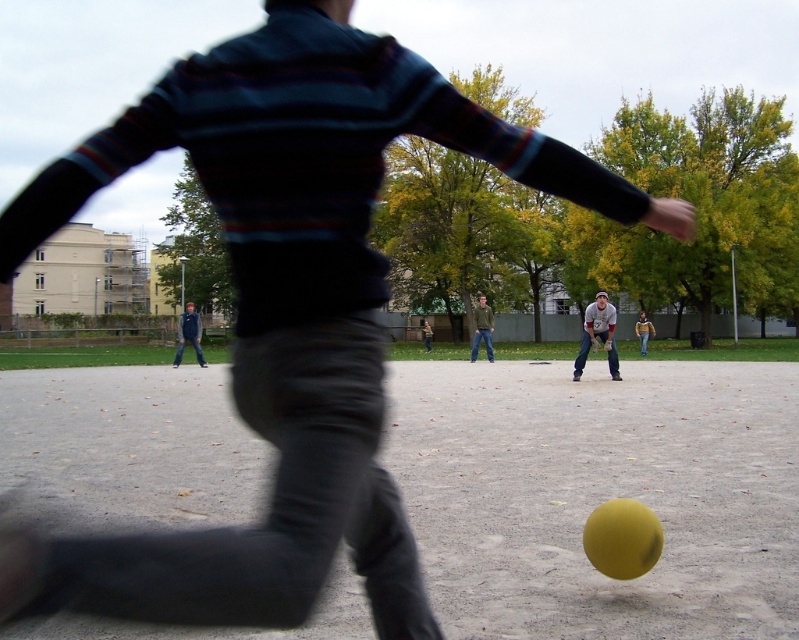
Which of these two, gray cotton shirt at center or denim jacket at center, stands taller?

denim jacket at center

Where is `gray cotton shirt at center`? gray cotton shirt at center is located at coordinates (598, 333).

Find the location of a particular element. Image resolution: width=799 pixels, height=640 pixels. gray cotton shirt at center is located at coordinates (598, 333).

Which of these two, dark blue jeans at center or denim jacket at center, stands shorter?

dark blue jeans at center

Find the location of a particular element. This screenshot has width=799, height=640. dark blue jeans at center is located at coordinates (189, 333).

Does gray cotton shirt at center have a lesser height compared to dark blue jeans at center?

Yes.

Is point (613, 340) closer to camera compared to point (177, 342)?

Yes, point (613, 340) is in front of point (177, 342).

Is point (575, 362) behind point (187, 330)?

No, it is in front of (187, 330).

Where is `gray cotton shirt at center`? This screenshot has height=640, width=799. gray cotton shirt at center is located at coordinates (598, 333).